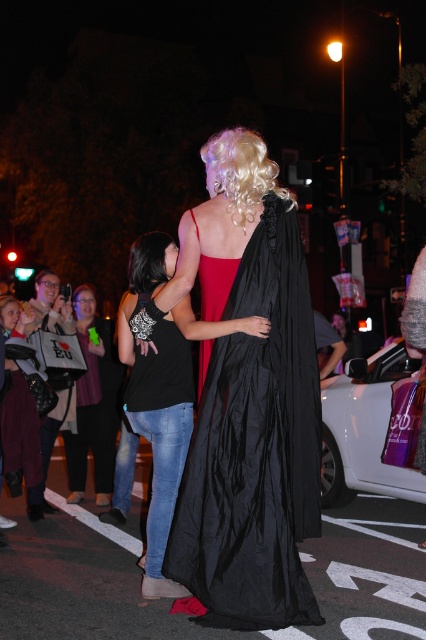
The image size is (426, 640). What do you see at coordinates (363, 429) in the screenshot?
I see `white glossy car at lower right` at bounding box center [363, 429].

Between white glossy car at lower right and maroon fabric coat at lower left, which one has more height?

white glossy car at lower right

Is point (356, 376) less distant than point (39, 442)?

No, it is not.

Identify the location of white glossy car at lower right. Image resolution: width=426 pixels, height=640 pixels. (363, 429).

Based on the photo, between matte black tank top at center and white fabric bag at lower left, which one has more height?

Standing taller between the two is matte black tank top at center.

Which is in front, point (89, 387) or point (31, 500)?

Point (31, 500)

Locate an element on the screen. matte black tank top at center is located at coordinates (94, 403).

Is point (109, 365) farther from camera compared to point (149, 241)?

Yes, point (109, 365) is farther from viewer.

Which is more to the left, matte black tank top at center or black silky hair at center?

From the viewer's perspective, matte black tank top at center appears more on the left side.

Identify the location of matte black tank top at center. (94, 403).